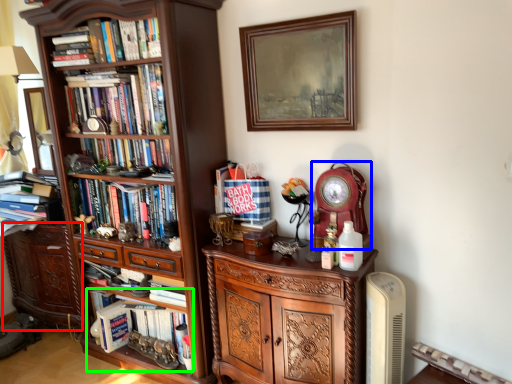
Question: Which object is the closest to the cabinetry (highlighted by a red box)? Choose among these: clock (highlighted by a blue box) or book (highlighted by a green box).

Choices:
 (A) clock
 (B) book

Answer: (B)